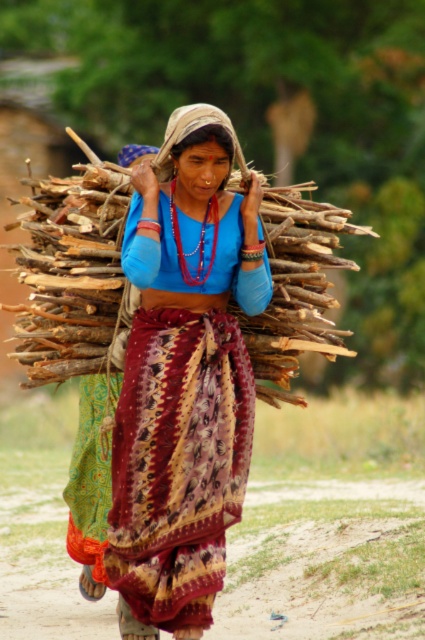
How far apart are matte blue blouse at center and matte blue shirt at center?

A distance of 22.37 inches exists between matte blue blouse at center and matte blue shirt at center.

Can you confirm if matte blue blouse at center is wider than matte blue shirt at center?

Yes, matte blue blouse at center is wider than matte blue shirt at center.

Describe the element at coordinates (184, 381) in the screenshot. This screenshot has height=640, width=425. I see `matte blue blouse at center` at that location.

This screenshot has height=640, width=425. I want to click on matte blue blouse at center, so click(184, 381).

Which of these two, wooden sticks at center or matte blue shirt at center, stands taller?

wooden sticks at center

From the picture: Is wooden sticks at center wider than matte blue shirt at center?

Correct, the width of wooden sticks at center exceeds that of matte blue shirt at center.

Is point (28, 308) positioned after point (243, 209)?

Yes, point (28, 308) is behind point (243, 209).

The width and height of the screenshot is (425, 640). I want to click on wooden sticks at center, so click(71, 273).

Is matte blue fabric at center closer to camera compared to matte blue shirt at center?

Yes.

The width and height of the screenshot is (425, 640). Describe the element at coordinates (204, 141) in the screenshot. I see `matte blue fabric at center` at that location.

The width and height of the screenshot is (425, 640). Describe the element at coordinates (204, 141) in the screenshot. I see `matte blue fabric at center` at that location.

Where is `matte blue fabric at center`? This screenshot has height=640, width=425. matte blue fabric at center is located at coordinates (204, 141).